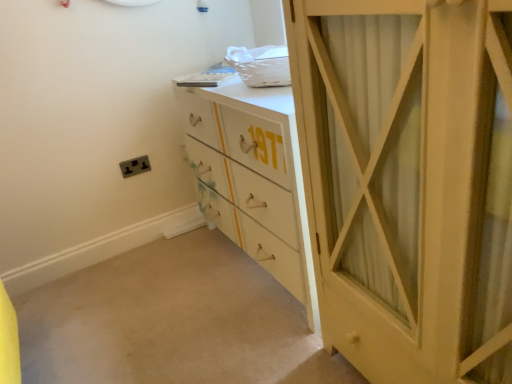
Question: Should I look upward or downward to see white painted wood chest of drawers at center?

Choices:
 (A) down
 (B) up

Answer: (B)

Question: Is the depth of white painted wood chest of drawers at center greater than that of matte black socket at lower left?

Choices:
 (A) yes
 (B) no

Answer: (B)

Question: Can you confirm if white painted wood chest of drawers at center is thinner than matte black socket at lower left?

Choices:
 (A) no
 (B) yes

Answer: (A)

Question: Is white painted wood chest of drawers at center at the left side of matte black socket at lower left?

Choices:
 (A) yes
 (B) no

Answer: (B)

Question: Is white painted wood chest of drawers at center completely or partially outside of matte black socket at lower left?

Choices:
 (A) no
 (B) yes

Answer: (B)

Question: From a real-world perspective, is white painted wood chest of drawers at center on matte black socket at lower left?

Choices:
 (A) yes
 (B) no

Answer: (B)

Question: Considering the relative sizes of white painted wood chest of drawers at center and matte black socket at lower left in the image provided, is white painted wood chest of drawers at center bigger than matte black socket at lower left?

Choices:
 (A) yes
 (B) no

Answer: (A)

Question: Does matte white cabinet at right lie behind white painted wood chest of drawers at center?

Choices:
 (A) yes
 (B) no

Answer: (B)

Question: Is white painted wood chest of drawers at center at the back of matte white cabinet at right?

Choices:
 (A) no
 (B) yes

Answer: (A)

Question: Considering the relative positions of matte white cabinet at right and white painted wood chest of drawers at center in the image provided, is matte white cabinet at right to the right of white painted wood chest of drawers at center from the viewer's perspective?

Choices:
 (A) yes
 (B) no

Answer: (A)

Question: Can we say matte white cabinet at right lies outside white painted wood chest of drawers at center?

Choices:
 (A) yes
 (B) no

Answer: (A)

Question: Considering the relative sizes of matte white cabinet at right and white painted wood chest of drawers at center in the image provided, is matte white cabinet at right wider than white painted wood chest of drawers at center?

Choices:
 (A) yes
 (B) no

Answer: (A)

Question: Is white painted wood chest of drawers at center located within matte white cabinet at right?

Choices:
 (A) no
 (B) yes

Answer: (A)

Question: Is matte white cabinet at right oriented away from matte black socket at lower left?

Choices:
 (A) yes
 (B) no

Answer: (B)